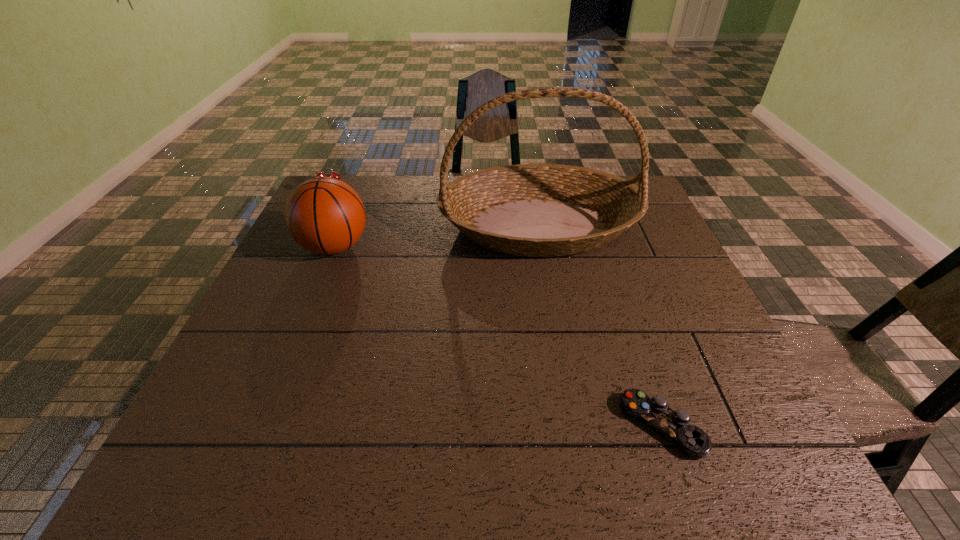
Locate an element on the screen. blank area at the near edge is located at coordinates (490, 480).

You are a GUI agent. You are given a task and a screenshot of the screen. Output one action in this format:
    pyautogui.click(x=<x>, y=<y>)
    Task: Click on the blank space at the left edge of the desktop
    The image size is (960, 540).
    Given the screenshot: What is the action you would take?
    pyautogui.click(x=289, y=280)

Where is `free space at the right edge of the desktop`? free space at the right edge of the desktop is located at coordinates pyautogui.click(x=691, y=389).

Find the location of a particular element. Image resolution: width=960 pixels, height=540 pixels. free area in between the third tallest object and the shortest object is located at coordinates (497, 311).

What are the coordinates of `empty space between the basket and the control` in the screenshot? It's located at (600, 326).

This screenshot has height=540, width=960. Identify the location of unoccupied area between the basket and the nearest object. (600, 326).

You are a GUI agent. You are given a task and a screenshot of the screen. Output one action in this format:
    pyautogui.click(x=<x>, y=<y>)
    Task: Click on the empty location between the third shortest object and the nearest object
    This screenshot has height=540, width=960.
    Given the screenshot: What is the action you would take?
    pyautogui.click(x=498, y=336)

Locate an element on the screen. free area in between the control and the tallest object is located at coordinates (600, 326).

In order to click on free space that is in between the nearest object and the basket in this screenshot , I will do `click(600, 326)`.

This screenshot has height=540, width=960. I want to click on free space between the basket and the shortest object, so click(600, 326).